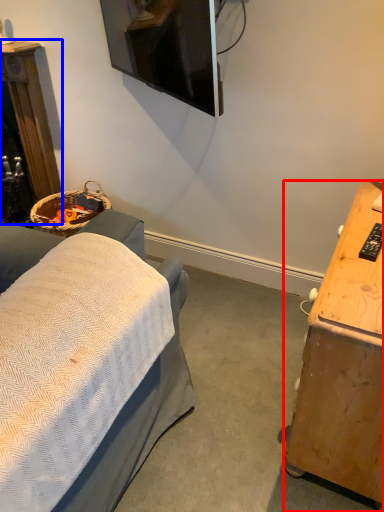
Question: Which object appears farthest to the camera in this image, desk (highlighted by a red box) or furniture (highlighted by a blue box)?

Choices:
 (A) desk
 (B) furniture

Answer: (B)